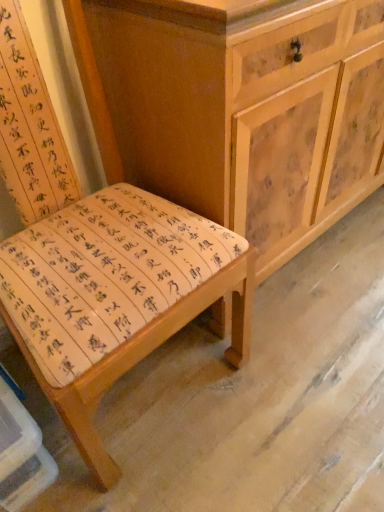
The width and height of the screenshot is (384, 512). Find the location of `wooden cabinet at center`. wooden cabinet at center is located at coordinates (230, 101).

What do you see at coordinates (230, 101) in the screenshot? This screenshot has height=512, width=384. I see `wooden cabinet at center` at bounding box center [230, 101].

Locate an element on the screen. The width and height of the screenshot is (384, 512). wooden bench at center is located at coordinates (97, 252).

Describe the element at coordinates (97, 252) in the screenshot. I see `wooden bench at center` at that location.

You are a GUI agent. You are given a task and a screenshot of the screen. Output one action in this format:
    pyautogui.click(x=<x>, y=<y>)
    Task: Click on the wooden cabinet at center
    
    Given the screenshot: What is the action you would take?
    pyautogui.click(x=230, y=101)

Is wooden cabinet at center at the left side of wooden bench at center?

No, wooden cabinet at center is not to the left of wooden bench at center.

Is wooden cabinet at center positioned in front of wooden bench at center?

That is False.

Does point (343, 152) come in front of point (141, 251)?

No, (343, 152) is further to viewer.

From the image's perspective, is wooden cabinet at center beneath wooden bench at center?

No, from the image's perspective, wooden cabinet at center is not beneath wooden bench at center.

In the scene shown: From a real-world perspective, is wooden cabinet at center on top of wooden bench at center?

No, from a real-world perspective, wooden cabinet at center is not above wooden bench at center.

Considering the sizes of wooden cabinet at center and wooden bench at center in the image, is wooden cabinet at center wider or thinner than wooden bench at center?

In the image, wooden cabinet at center appears to be more narrow than wooden bench at center.

Which of these two, wooden cabinet at center or wooden bench at center, stands shorter?

wooden cabinet at center is shorter.

Is wooden cabinet at center smaller than wooden bench at center?

No, wooden cabinet at center is not smaller than wooden bench at center.

Is wooden cabinet at center positioned beyond the bounds of wooden bench at center?

wooden cabinet at center lies outside wooden bench at center's area.

Would you consider wooden cabinet at center to be distant from wooden bench at center?

No, wooden cabinet at center is not far away from wooden bench at center.

In the scene shown: Is wooden cabinet at center looking in the opposite direction of wooden bench at center?

No, wooden cabinet at center's orientation is not away from wooden bench at center.

How different are the orientations of wooden cabinet at center and wooden bench at center in degrees?

There is a 0.38-degree angle between the facing directions of wooden cabinet at center and wooden bench at center.

How distant is wooden cabinet at center from wooden bench at center?

wooden cabinet at center and wooden bench at center are 10.79 inches apart from each other.

At what (x,y) coordinates should I click in order to perform the action: click on chest of drawers behind the wooden bench at center. Please return your answer as a coordinate pair (x, y). This screenshot has width=384, height=512. Looking at the image, I should click on (230, 101).

Based on the photo, considering the positions of objects wooden bench at center and wooden cabinet at center in the image provided, who is more to the left, wooden bench at center or wooden cabinet at center?

Positioned to the left is wooden bench at center.

Considering the positions of objects wooden bench at center and wooden cabinet at center in the image provided, who is behind, wooden bench at center or wooden cabinet at center?

Positioned behind is wooden cabinet at center.

Which point is more distant from viewer, (x=187, y=283) or (x=189, y=102)?

The point (x=189, y=102) is farther from the camera.

From the image's perspective, is wooden bench at center located beneath wooden cabinet at center?

Yes, from the image's perspective, wooden bench at center is beneath wooden cabinet at center.

From a real-world perspective, is wooden bench at center physically located above or below wooden cabinet at center?

wooden bench at center is situated higher than wooden cabinet at center in the real world.

Considering the sizes of objects wooden bench at center and wooden cabinet at center in the image provided, who is thinner, wooden bench at center or wooden cabinet at center?

wooden cabinet at center.

Considering the sizes of objects wooden bench at center and wooden cabinet at center in the image provided, who is taller, wooden bench at center or wooden cabinet at center?

wooden bench at center is taller.

Between wooden bench at center and wooden cabinet at center, which one has smaller size?

wooden bench at center is smaller.

Is wooden bench at center inside the boundaries of wooden cabinet at center, or outside?

wooden bench at center exists outside the volume of wooden cabinet at center.

Are wooden bench at center and wooden cabinet at center located far from each other?

wooden bench at center is near wooden cabinet at center, not far away.

Looking at this image, is wooden bench at center facing towards wooden cabinet at center?

No, wooden bench at center does not turn towards wooden cabinet at center.

The width and height of the screenshot is (384, 512). In order to click on chest of drawers below the wooden bench at center (from a real-world perspective) in this screenshot , I will do coord(230,101).

Find the location of a particular element. chair that is on the left side of wooden cabinet at center is located at coordinates (97, 252).

Find the location of a particular element. Image resolution: width=384 pixels, height=512 pixels. chair in front of the wooden cabinet at center is located at coordinates (97, 252).